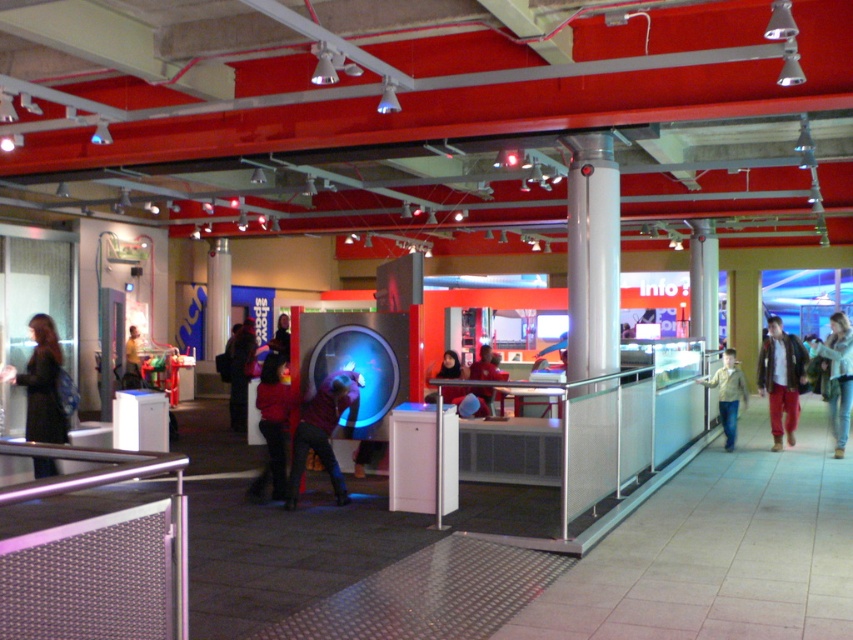
Question: Is leather jacket at right behind matte red sweater at center?

Choices:
 (A) no
 (B) yes

Answer: (B)

Question: Does black leather jacket at left appear over light brown shirt at center?

Choices:
 (A) yes
 (B) no

Answer: (A)

Question: Which is farther from the reddish-brown leather jacket at center?

Choices:
 (A) dark red sweater at center
 (B) yellow shirt at center

Answer: (A)

Question: Does black leather jacket at left have a lesser width compared to reddish-brown leather jacket at center?

Choices:
 (A) yes
 (B) no

Answer: (A)

Question: Which point is closer to the camera taking this photo?

Choices:
 (A) (792, 444)
 (B) (310, 412)
 (C) (846, 381)
 (D) (56, 365)

Answer: (D)

Question: Which point is farther to the camera?

Choices:
 (A) (793, 397)
 (B) (126, 376)

Answer: (A)